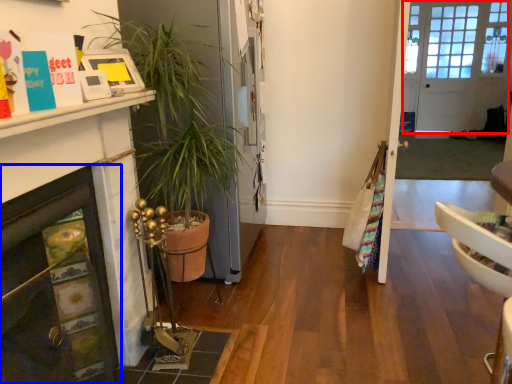
Question: Which of the following is the closest to the observer, door (highlighted by a red box) or fireplace (highlighted by a blue box)?

Choices:
 (A) door
 (B) fireplace

Answer: (B)